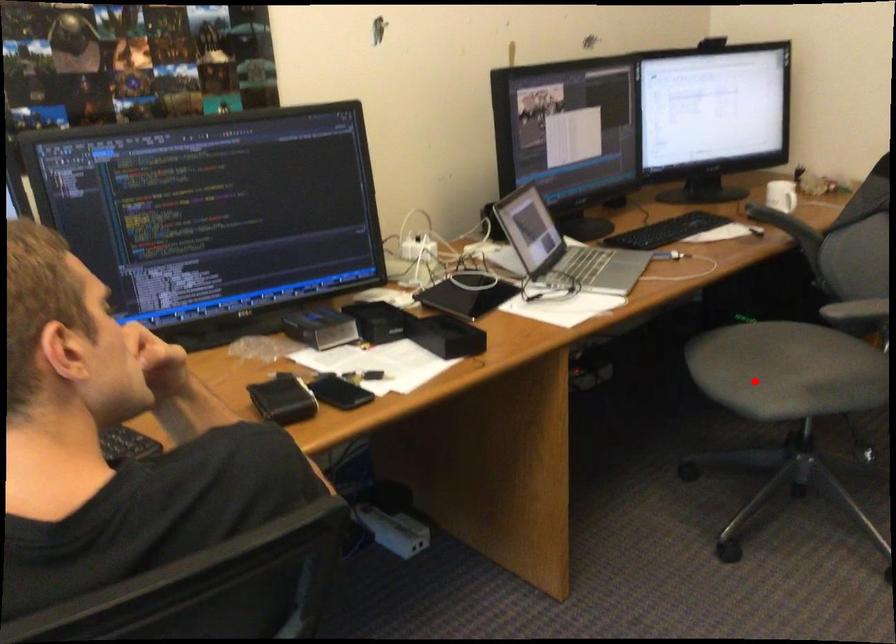
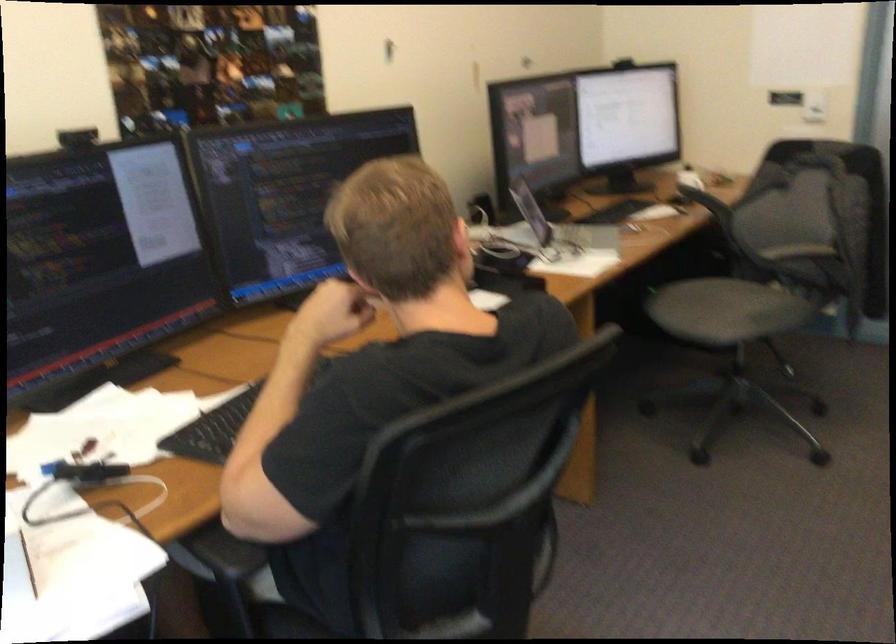
Question: I am providing you with two images of the same scene from different viewpoints. Image1 has a red point marked. In image2, the corresponding 3D location appears at what relative position? Reply with the corresponding letter.

Choices:
 (A) Closer
 (B) Farther

Answer: (B)